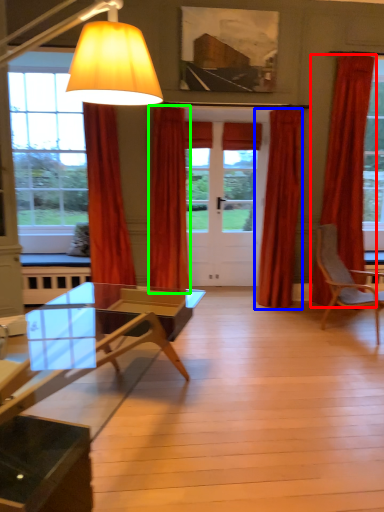
Question: Which object is the closest to the curtain (highlighted by a red box)? Choose among these: curtain (highlighted by a blue box) or curtain (highlighted by a green box).

Choices:
 (A) curtain
 (B) curtain

Answer: (A)